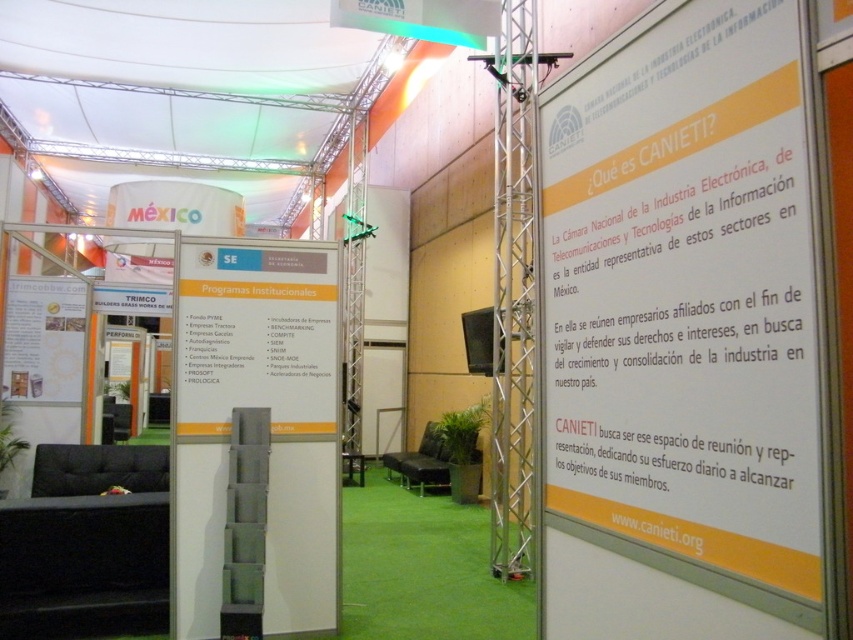
Question: Can you confirm if yellow paperboard sign at right is positioned to the right of white cardboard sign at left?

Choices:
 (A) no
 (B) yes

Answer: (B)

Question: Which point appears farthest from the camera in this image?

Choices:
 (A) (285, 460)
 (B) (662, 323)

Answer: (A)

Question: Which object appears closest to the camera in this image?

Choices:
 (A) yellow paperboard sign at right
 (B) white cardboard sign at left

Answer: (A)

Question: Observing the image, what is the correct spatial positioning of yellow paperboard sign at right in reference to white cardboard sign at left?

Choices:
 (A) above
 (B) below

Answer: (A)

Question: Does yellow paperboard sign at right have a smaller size compared to white cardboard sign at left?

Choices:
 (A) no
 (B) yes

Answer: (B)